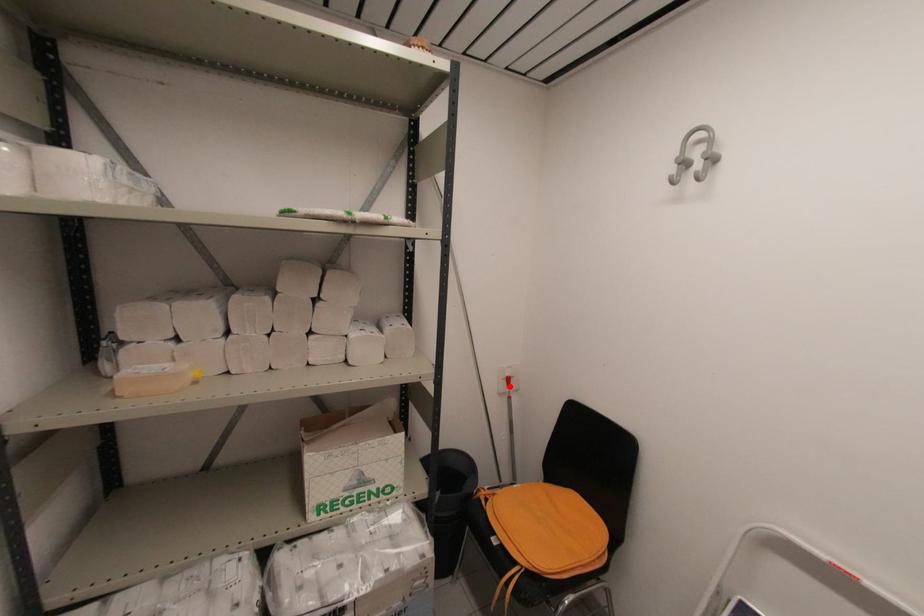
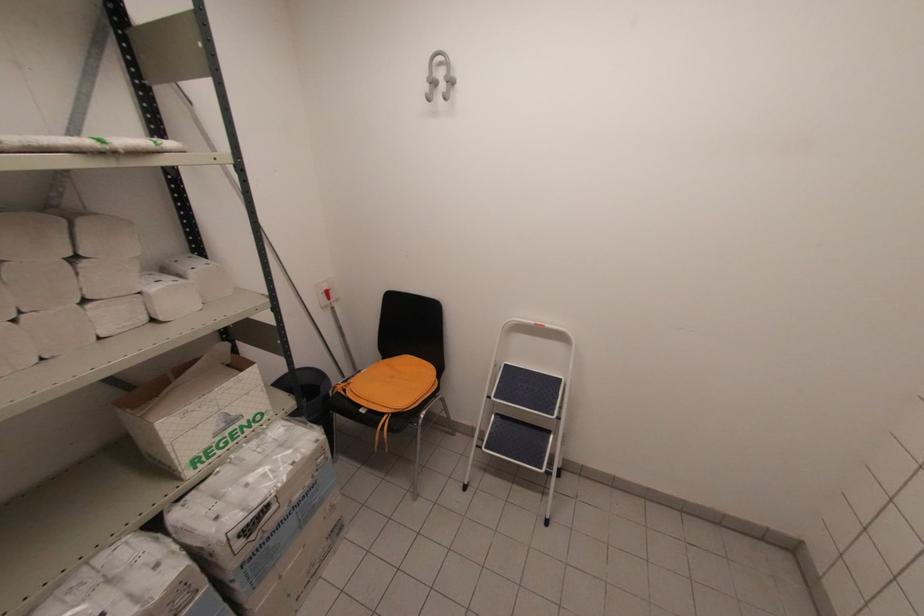
Question: I am providing you with two images of the same scene from different viewpoints. Given a red point in image1, look at the same physical point in image2. Is it:

Choices:
 (A) Closer to the viewpoint
 (B) Farther from the viewpoint

Answer: (A)